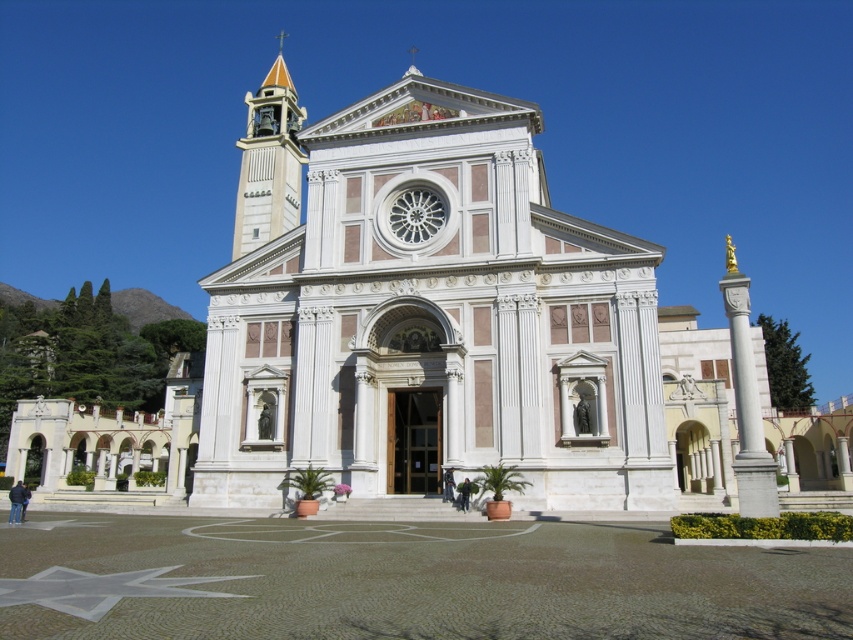
You are standing in front of the church and notice two points marked on the facade. Which point, point (468, 500) or point (450, 490), is closer to you?

Point (468, 500) is closer to the viewer than point (450, 490).

You are an architect designing a new building and want to incorporate elements from this church. You notice the matte orange bell tower at upper left and the black leather jacket at center. Which of these two objects has a greater width in the image?

The matte orange bell tower at upper left has a greater width than the black leather jacket at center according to the description.

In the scene shown: You are a photographer standing in front of the classical church with its symmetrical facade and tall bell tower. You notice two jackets, the dark gray fabric jacket at lower center and the black leather jacket at center. If you want to take a photo that includes both jackets without moving them, what is the minimum distance you need to step back to ensure both are fully in frame?

The dark gray fabric jacket at lower center and the black leather jacket at center are 27.21 inches apart. To include both jackets in the photo without moving them, you need to step back enough to cover at least 27.21 inches between them in your camera frame.